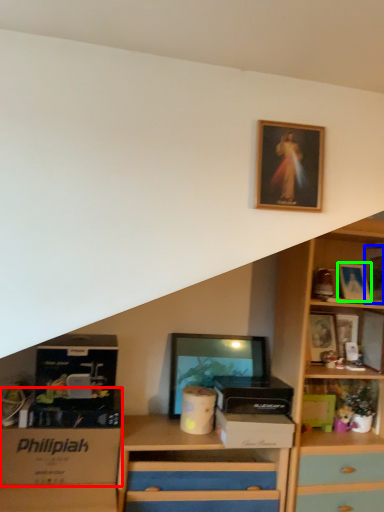
Question: Based on their relative distances, which object is farther from storage box (highlighted by a red box)? Choose from picture frame (highlighted by a blue box) and picture frame (highlighted by a green box).

Choices:
 (A) picture frame
 (B) picture frame

Answer: (A)